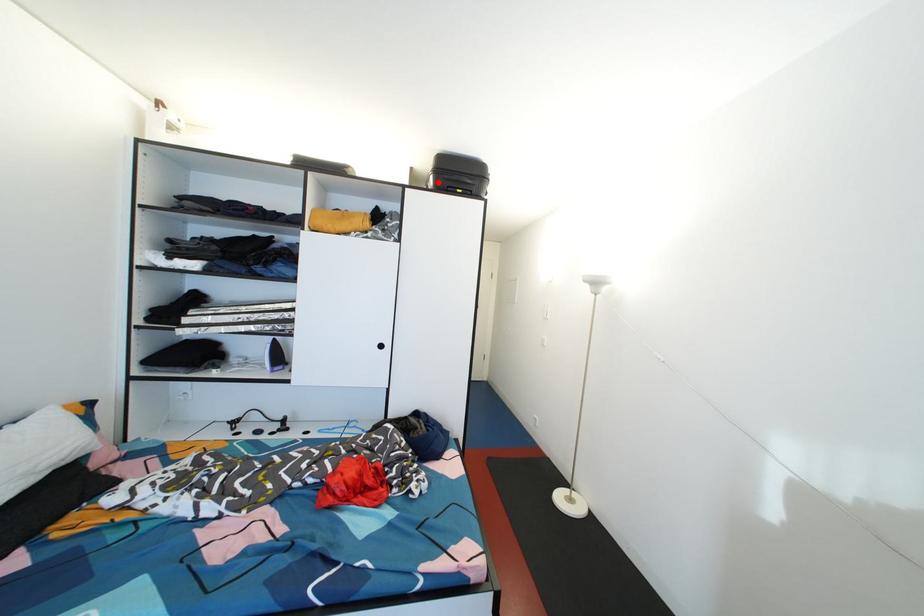
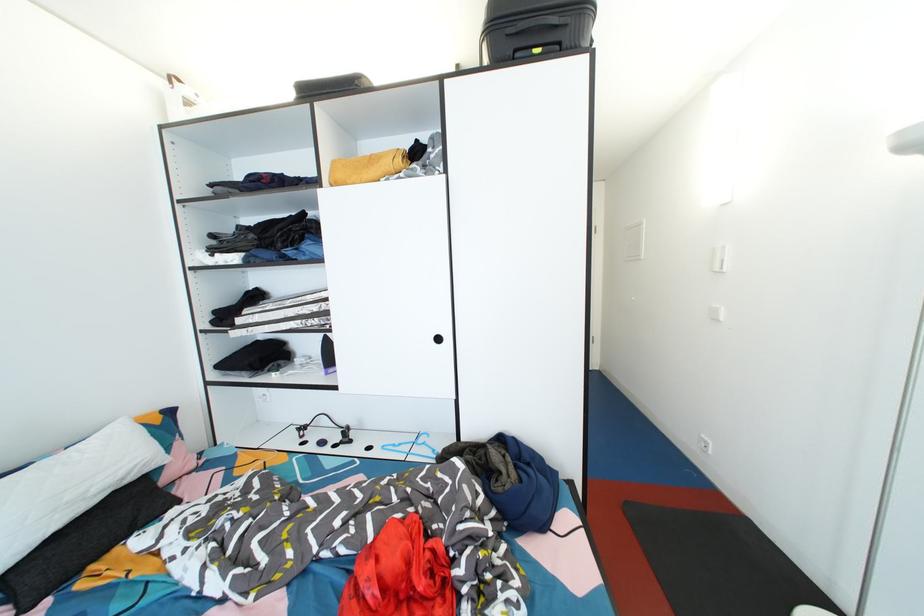
Question: I am providing you with two images of the same scene from different viewpoints. Given a red point in image1, look at the same physical point in image2. Is it:

Choices:
 (A) Closer to the viewpoint
 (B) Farther from the viewpoint

Answer: (B)